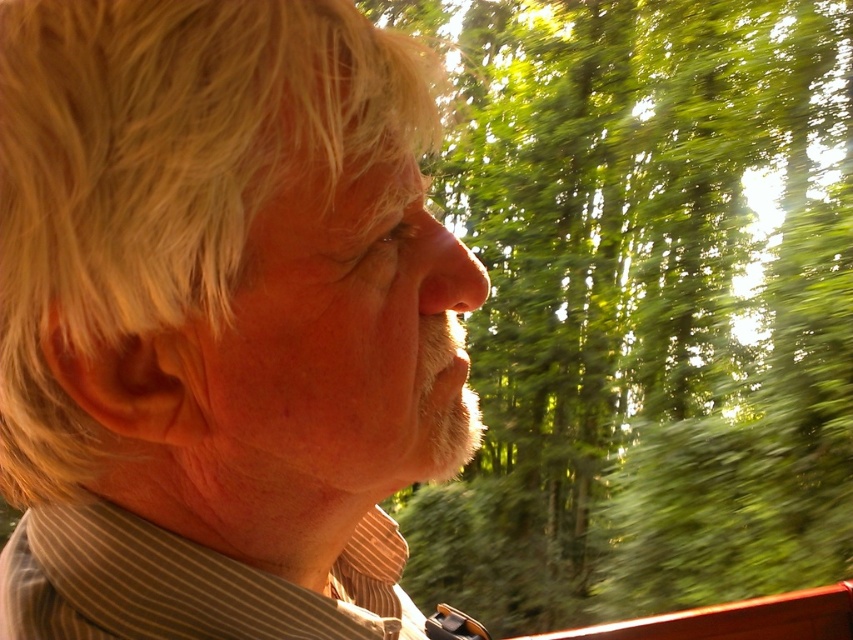
Can you confirm if light brown striped shirt at center is shorter than green leafy trees at upper right?

Indeed, light brown striped shirt at center has a lesser height compared to green leafy trees at upper right.

The width and height of the screenshot is (853, 640). Describe the element at coordinates (221, 308) in the screenshot. I see `light brown striped shirt at center` at that location.

Image resolution: width=853 pixels, height=640 pixels. I want to click on light brown striped shirt at center, so click(221, 308).